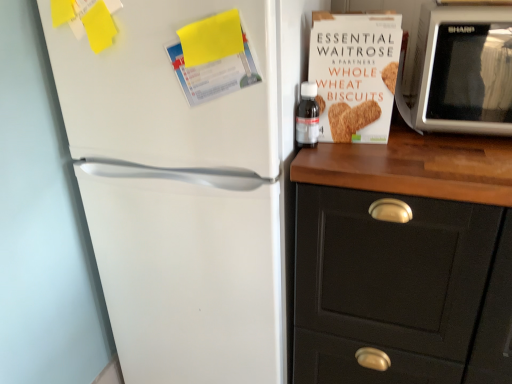
Where is `free location above black matte cabinet at right (from a real-world perspective)`? The width and height of the screenshot is (512, 384). free location above black matte cabinet at right (from a real-world perspective) is located at coordinates (431, 148).